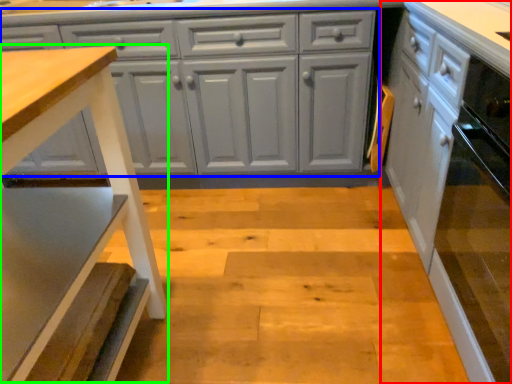
Question: Estimate the real-world distances between objects in this image. Which object is closer to cabinetry (highlighted by a red box), cabinetry (highlighted by a blue box) or step stool (highlighted by a green box)?

Choices:
 (A) cabinetry
 (B) step stool

Answer: (A)